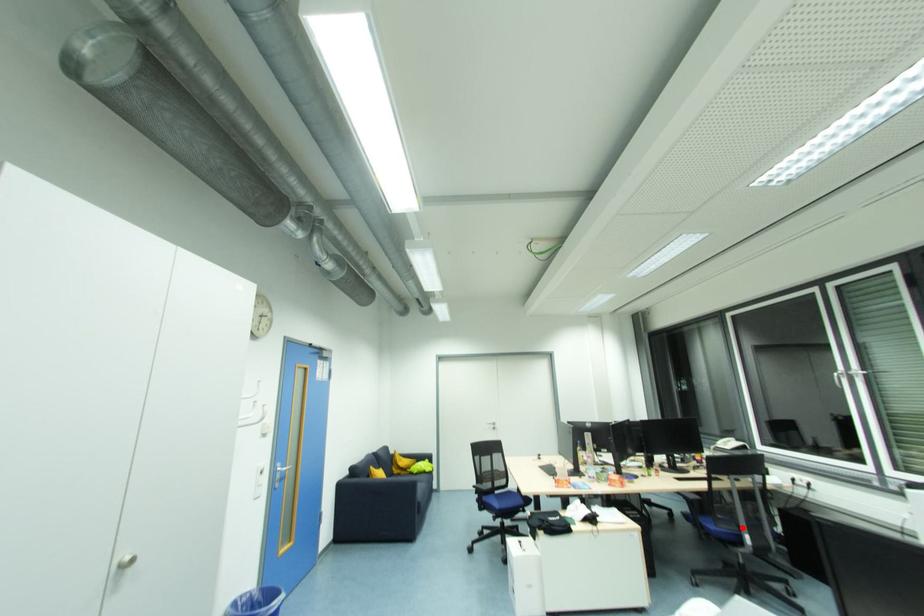
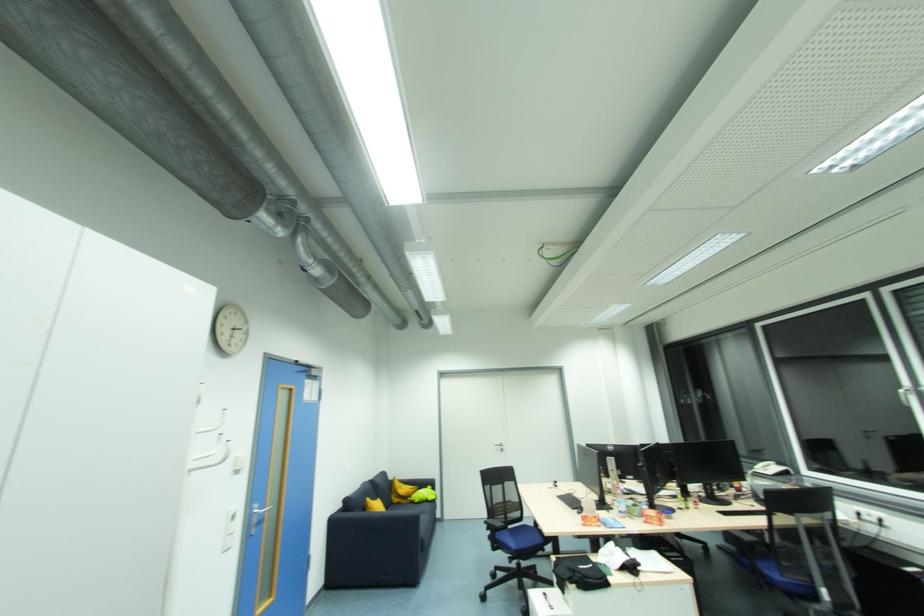
Find the pixel in the second image that matches the highlighted location in the first image.

(813, 578)